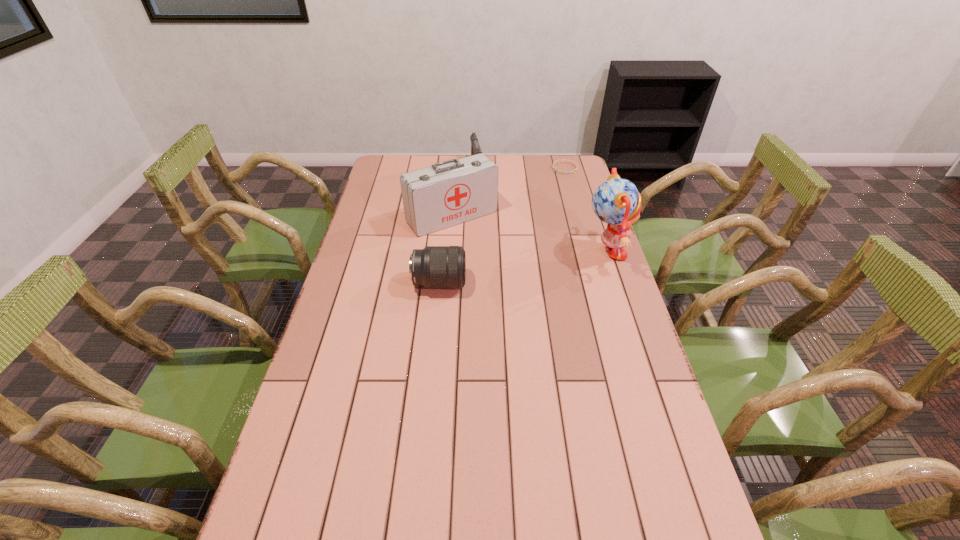
Find the location of a particular element. vacant space at the near edge of the desktop is located at coordinates (457, 532).

This screenshot has width=960, height=540. I want to click on blank space at the left edge of the desktop, so click(x=310, y=372).

Identify the location of vacant space at the right edge. (588, 192).

The image size is (960, 540). In the image, there is a desktop. Identify the location of blank space at the far left corner. (390, 179).

In order to click on vacant region at the far right corner of the desktop in this screenshot , I will do `click(577, 173)`.

Identify the location of free space at the near right corner. (699, 528).

Image resolution: width=960 pixels, height=540 pixels. I want to click on unoccupied area between the second tallest object and the bracelet, so click(x=509, y=193).

Image resolution: width=960 pixels, height=540 pixels. What are the coordinates of `empty space between the tallest object and the telephoto lens` in the screenshot? It's located at (522, 268).

The height and width of the screenshot is (540, 960). In order to click on free space between the shortest object and the tallest object in this screenshot , I will do `click(585, 211)`.

The width and height of the screenshot is (960, 540). I want to click on vacant area that lies between the doll and the shortest object, so click(x=585, y=211).